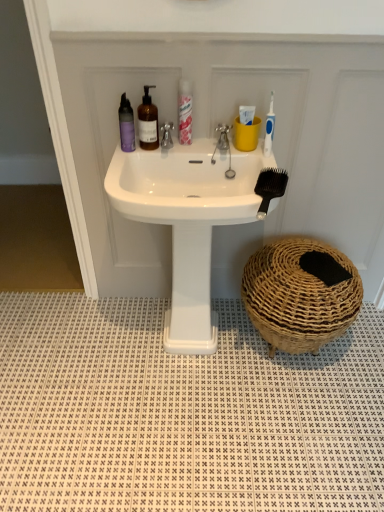
Identify the location of vacant area that lies between translucent pink spray can at upper center and metallic silver faucet at center, the second tap in the left-to-right sequence. (204, 146).